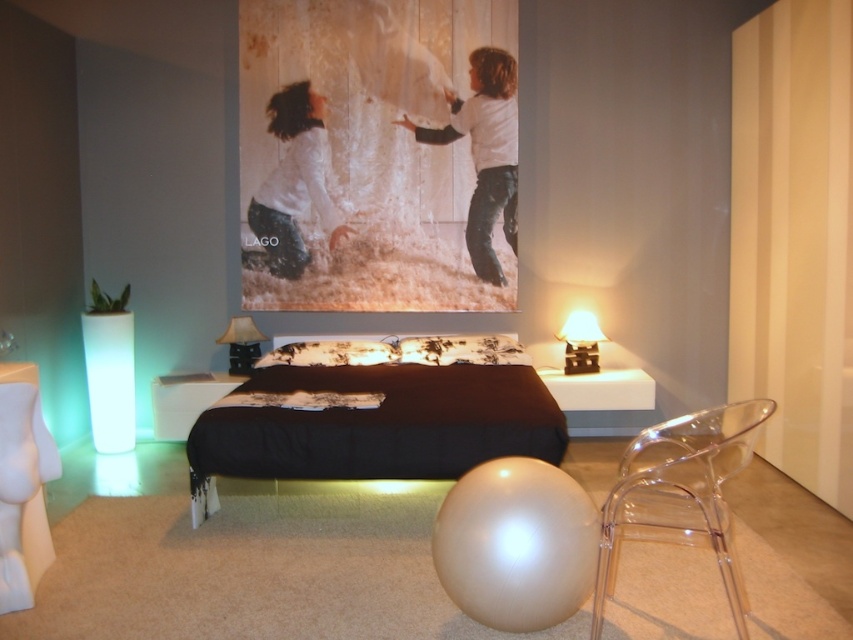
Question: Is white textured fabric at upper center in front of matte black lampshade at right?

Choices:
 (A) no
 (B) yes

Answer: (A)

Question: Can you confirm if white floral fabric pillow at center is thinner than white textured pillow at center?

Choices:
 (A) yes
 (B) no

Answer: (A)

Question: Which point is farther to the camera?

Choices:
 (A) (505, 355)
 (B) (648, 522)
 (C) (566, 328)

Answer: (C)

Question: Which of the following is the farthest from the observer?

Choices:
 (A) (471, 170)
 (B) (241, 356)

Answer: (B)

Question: Can you confirm if white glossy stool at lower center is wider than white floral fabric pillow at center?

Choices:
 (A) yes
 (B) no

Answer: (B)

Question: Based on their relative distances, which object is nearer to the matte black lampshade at right?

Choices:
 (A) white textured pillow at center
 (B) transparent acrylic chair at lower right
 (C) matte black lampshade at upper center
 (D) white textured fabric at upper center

Answer: (D)